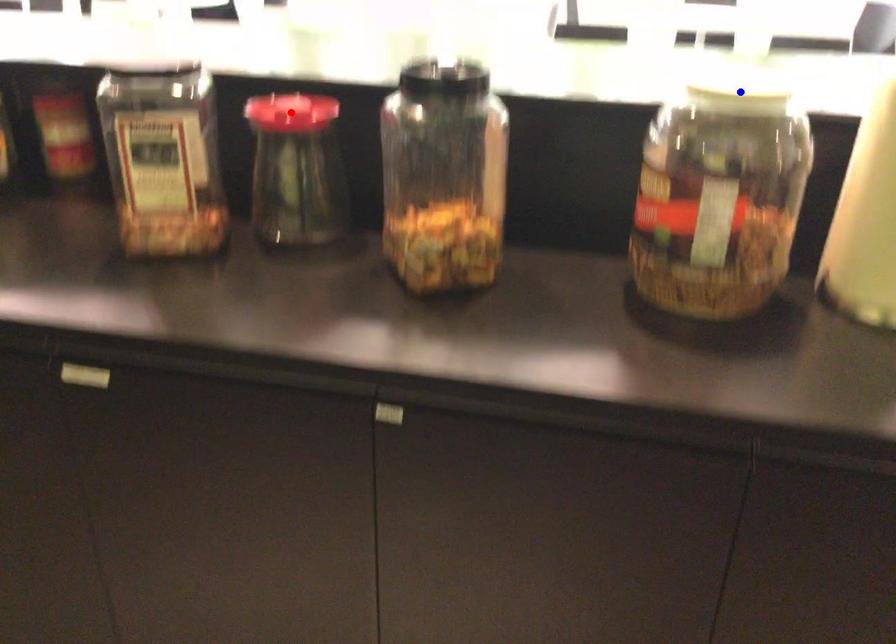
Question: In the image, two points are highlighted. Which point is nearer to the camera? Reply with the corresponding letter.

Choices:
 (A) blue point
 (B) red point

Answer: (A)